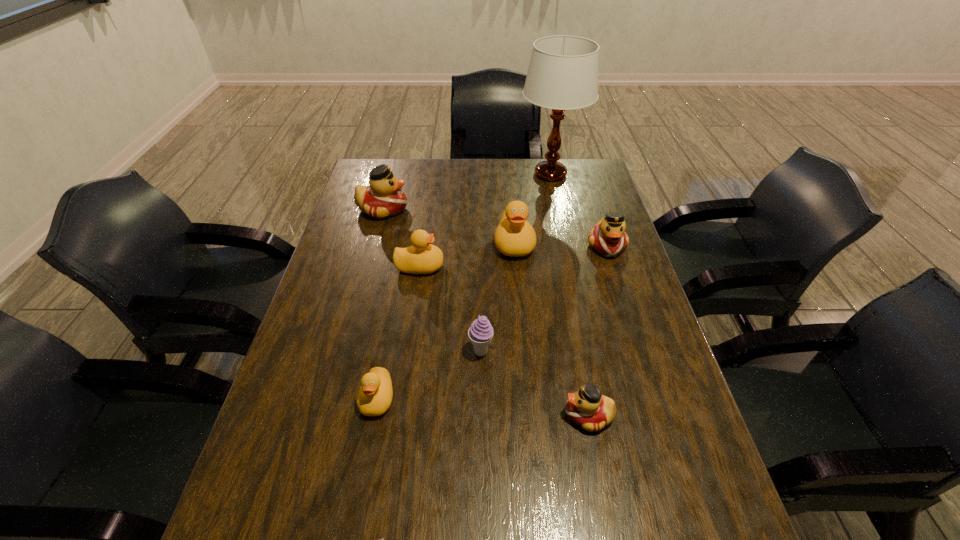
Locate an element on the screen. The image size is (960, 540). the farthest object is located at coordinates (563, 71).

Locate an element on the screen. The width and height of the screenshot is (960, 540). brown table lamp is located at coordinates (563, 71).

The width and height of the screenshot is (960, 540). I want to click on the biggest red duck, so click(384, 198).

The width and height of the screenshot is (960, 540). Identify the location of the eighth nearest object. (384, 198).

Locate an element on the screen. Image resolution: width=960 pixels, height=540 pixels. the fourth duck from left to right is located at coordinates (515, 236).

At what (x,y) coordinates should I click in order to perform the action: click on the rightmost yellow duck. Please return your answer as a coordinate pair (x, y). Image resolution: width=960 pixels, height=540 pixels. Looking at the image, I should click on (515, 236).

I want to click on the rightmost red duck, so tap(608, 237).

Locate an element on the screen. The height and width of the screenshot is (540, 960). the rightmost duck is located at coordinates (608, 237).

Locate an element on the screen. The height and width of the screenshot is (540, 960). the second biggest yellow duck is located at coordinates (421, 258).

The height and width of the screenshot is (540, 960). Find the location of `icecream`. icecream is located at coordinates (480, 333).